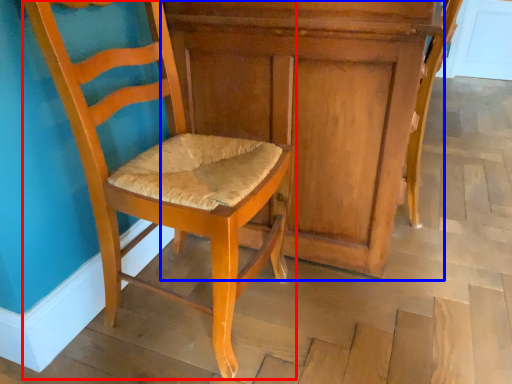
Question: Which point is further to the camera, chair (highlighted by a red box) or dresser (highlighted by a blue box)?

Choices:
 (A) chair
 (B) dresser

Answer: (B)